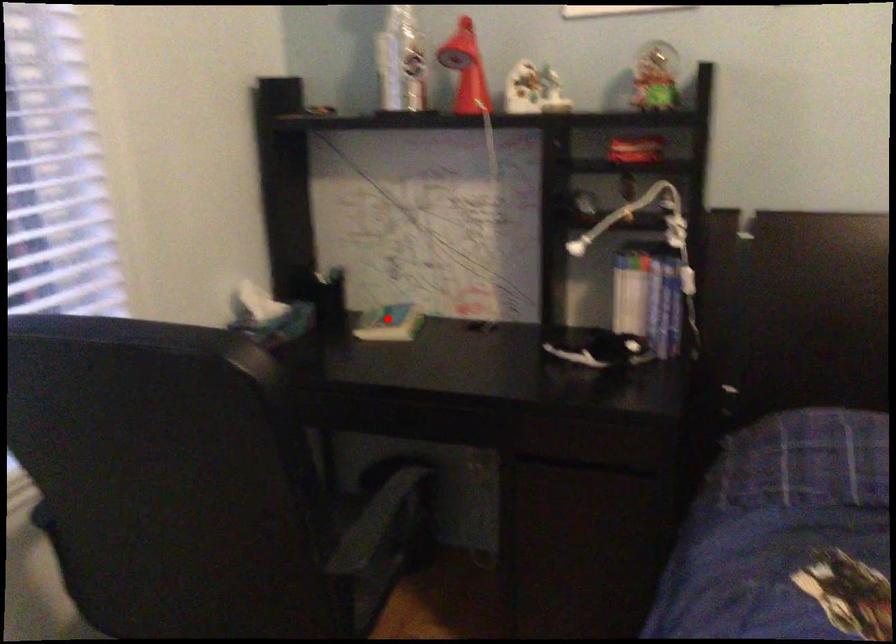
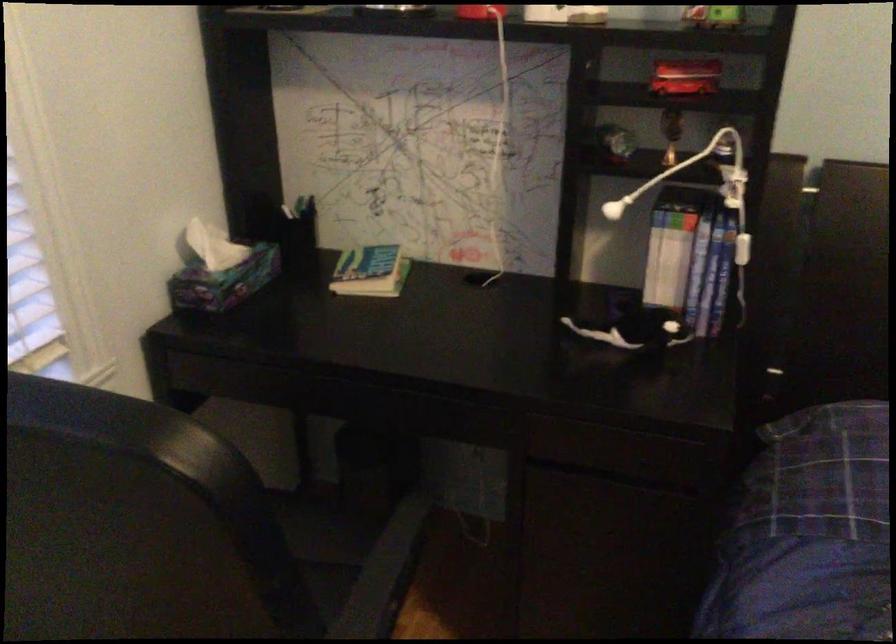
Find the pixel in the second image that matches the highlighted location in the first image.

(371, 270)